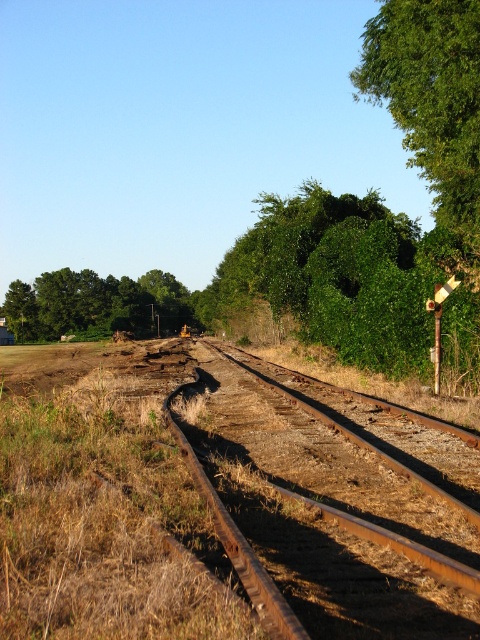
Which is more to the right, green leafy tree at upper left or rusty metal pole at right?

rusty metal pole at right

Can you confirm if green leafy tree at upper left is smaller than rusty metal pole at right?

Incorrect, green leafy tree at upper left is not smaller in size than rusty metal pole at right.

What do you see at coordinates (95, 305) in the screenshot? Image resolution: width=480 pixels, height=640 pixels. I see `green leafy tree at upper left` at bounding box center [95, 305].

Where is `green leafy tree at upper left`? The image size is (480, 640). green leafy tree at upper left is located at coordinates (95, 305).

Which is behind, point (290, 528) or point (166, 289)?

Positioned behind is point (166, 289).

Who is higher up, rusty metal train track at center or green leafy tree at upper left?

green leafy tree at upper left is above.

Where is `rusty metal train track at center`? The height and width of the screenshot is (640, 480). rusty metal train track at center is located at coordinates (338, 504).

Does rusty metal train track at center appear over rusty metal pole at right?

No, rusty metal train track at center is not above rusty metal pole at right.

Between point (448, 544) and point (435, 380), which one is positioned behind?

The point (435, 380) is more distant.

Looking at this image, who is more forward, [253,508] or [436,374]?

Point [253,508]

Locate an element on the screen. rusty metal train track at center is located at coordinates (338, 504).